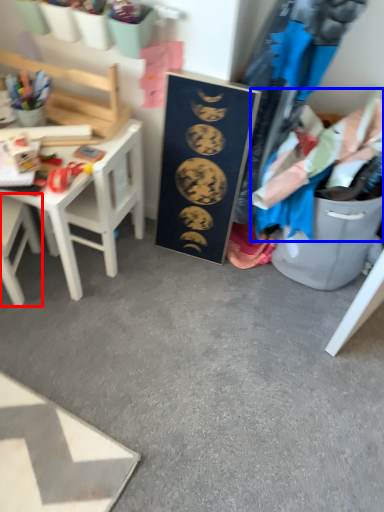
Question: Which object is further to the camera taking this photo, chair (highlighted by a red box) or clothing (highlighted by a blue box)?

Choices:
 (A) chair
 (B) clothing

Answer: (A)